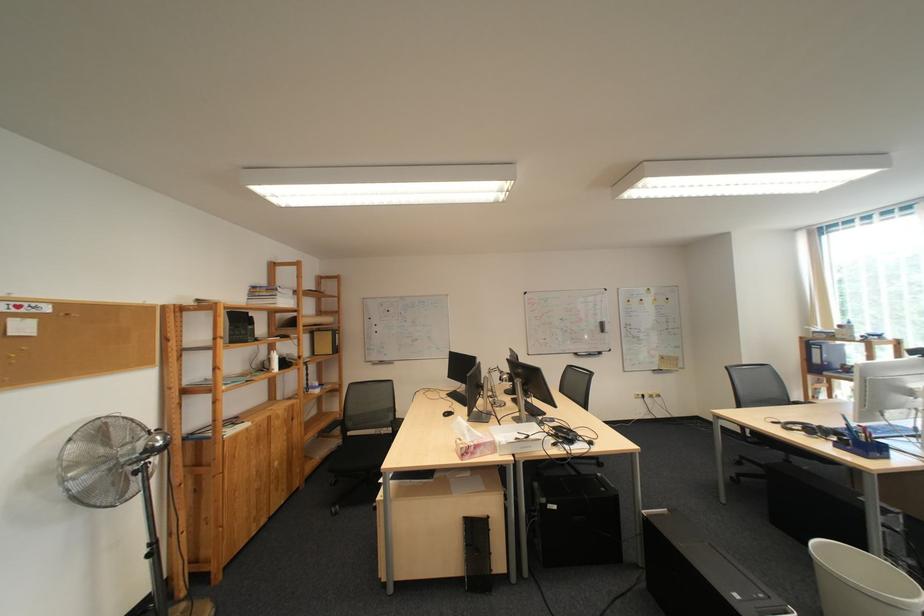
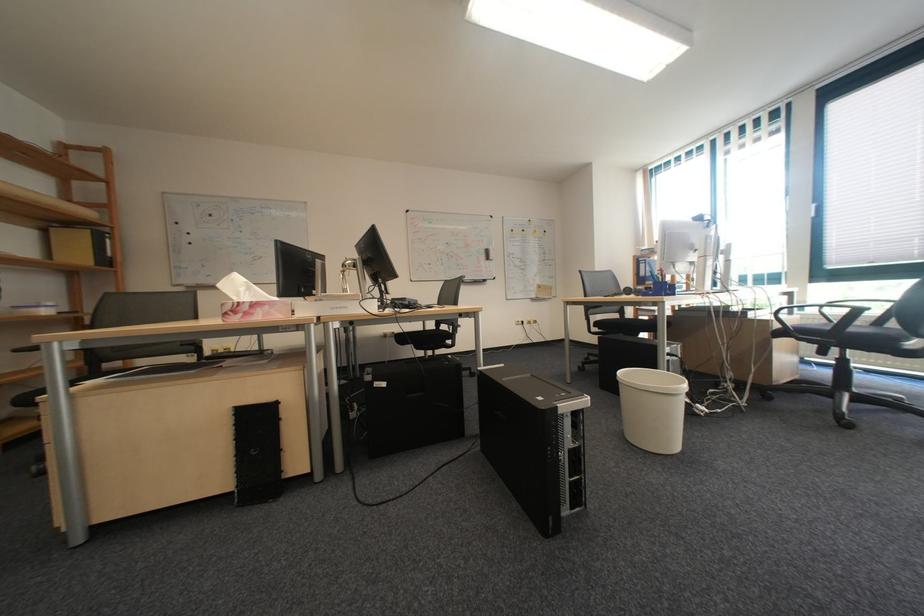
In the second image, find the point that corresponds to the point at 548,312 in the first image.

(431, 233)